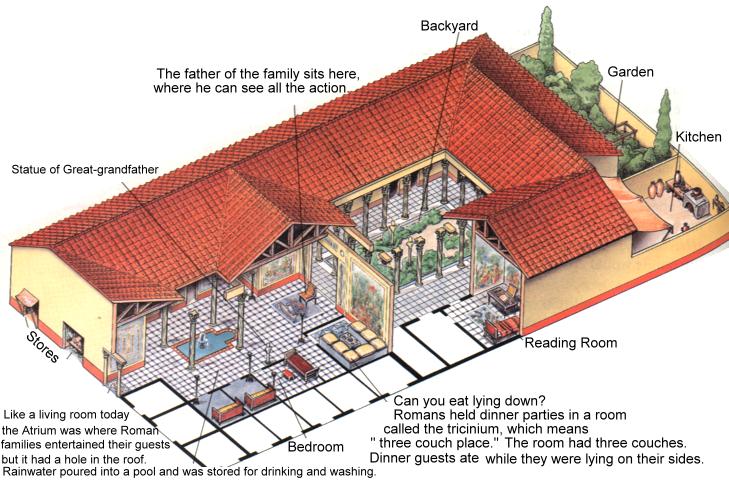
You are a GUI agent. You are given a task and a screenshot of the screen. Output one action in this format:
    pyautogui.click(x=<x>, y=<y>)
    Task: Click on the 1 reading room
    
    Given the screenshot: What is the action you would take?
    pyautogui.click(x=507, y=314)